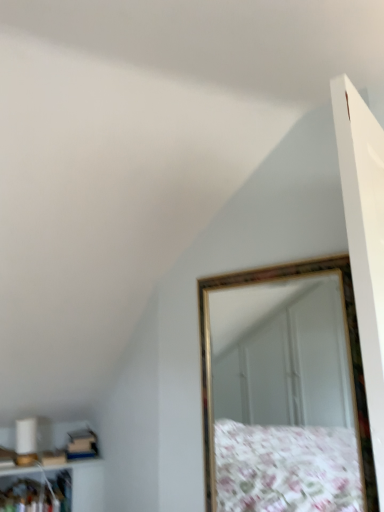
Find the location of a particular element. This screenshot has height=512, width=384. free point above gold-framed mirror at upper right (from a real-world perspective) is located at coordinates (284, 260).